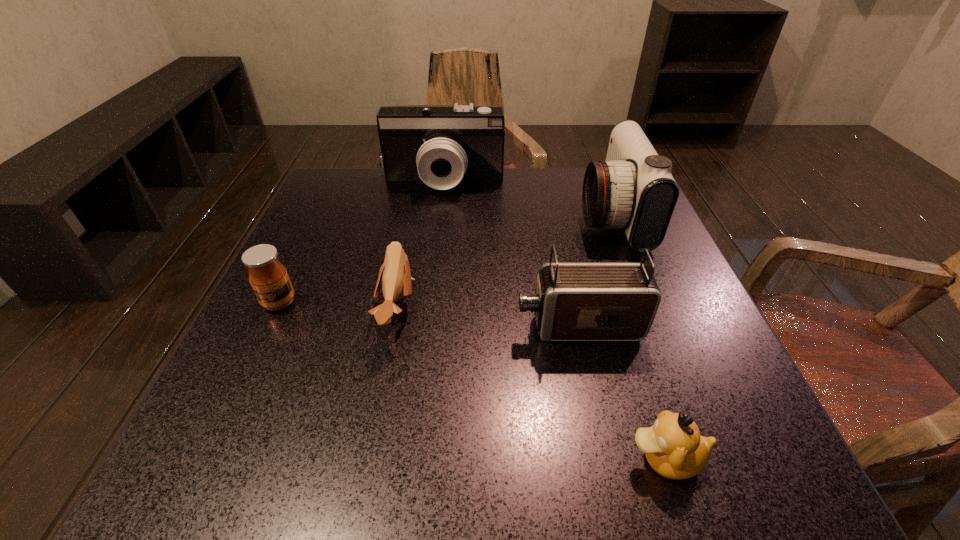
You are a GUI agent. You are given a task and a screenshot of the screen. Output one action in this format:
    pyautogui.click(x=<x>, y=<y>)
    Task: Click on the free space located 0.170m at the beak of the bird
    The width and height of the screenshot is (960, 540).
    Given the screenshot: What is the action you would take?
    [x=510, y=310]

Image resolution: width=960 pixels, height=540 pixels. I want to click on free space located 0.200m on the face of the nearest object, so click(x=477, y=459).

This screenshot has width=960, height=540. Find the location of `blank space located 0.160m on the face of the nearest object`. blank space located 0.160m on the face of the nearest object is located at coordinates (507, 459).

In order to click on vacant space located 0.060m on the face of the nearest object in this screenshot , I will do `click(582, 459)`.

Identify the location of object that is at the near edge. (673, 446).

The height and width of the screenshot is (540, 960). I want to click on camcorder at the left edge, so click(440, 145).

This screenshot has width=960, height=540. What are the coordinates of `honey that is at the left edge` in the screenshot? It's located at (268, 277).

Locate an element on the screen. The image size is (960, 540). duckling located at the right edge is located at coordinates tap(673, 446).

This screenshot has height=540, width=960. Identify the location of object present at the far left corner. 440,145.

Locate an element on the screen. object positioned at the far right corner is located at coordinates (633, 189).